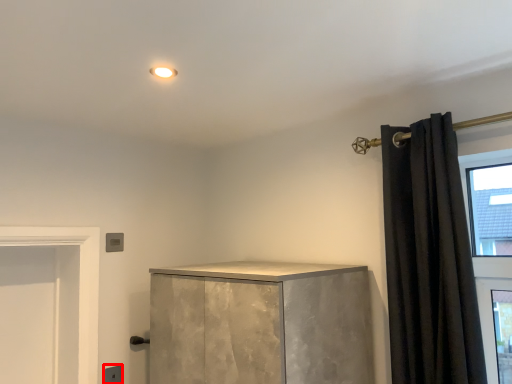
Question: Considering the relative positions of electric outlet (annotated by the red box) and curtain in the image provided, where is electric outlet (annotated by the red box) located with respect to the staircase?

Choices:
 (A) right
 (B) left

Answer: (B)